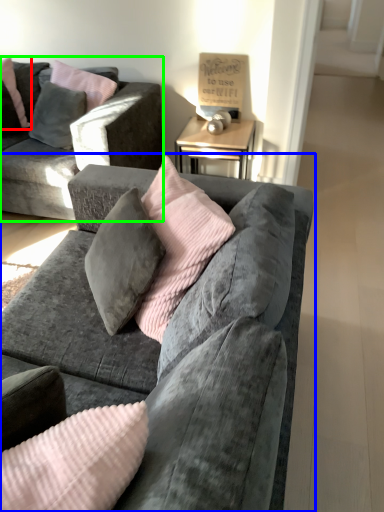
Question: Estimate the real-world distances between objects in this image. Which object is farther from pillow (highlighted by a red box), studio couch (highlighted by a blue box) or studio couch (highlighted by a green box)?

Choices:
 (A) studio couch
 (B) studio couch

Answer: (A)